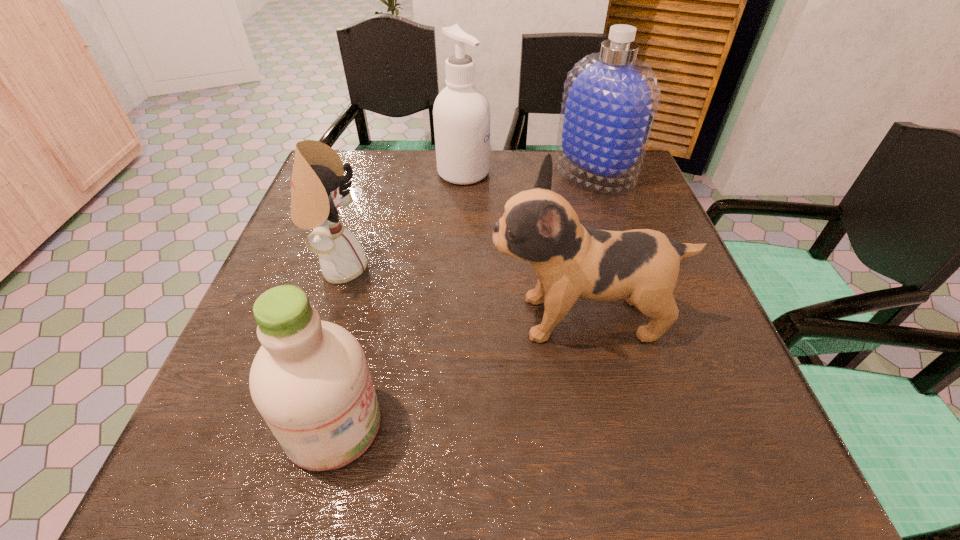
The image size is (960, 540). Find the location of `free space between the nearest object and the rightmost cleansing agent`. free space between the nearest object and the rightmost cleansing agent is located at coordinates (464, 299).

Find the location of a particular element. This screenshot has width=960, height=540. object that stands as the third closest to the puppy is located at coordinates (610, 99).

Identify which object is the closest to the second cleansing agent from left to right. Please provide its 2D coordinates. Your answer should be formatted as a tuple, i.e. [(x, y)], where the tuple contains the x and y coordinates of a point satisfying the conditions above.

[(610, 99)]

Where is `cleansing agent that is the closest to the rightmost cleansing agent`? This screenshot has width=960, height=540. cleansing agent that is the closest to the rightmost cleansing agent is located at coordinates (461, 113).

At what (x,y) coordinates should I click in order to perform the action: click on cleansing agent that can be found as the closest to the leftmost cleansing agent. Please return your answer as a coordinate pair (x, y). This screenshot has height=540, width=960. Looking at the image, I should click on (461, 113).

This screenshot has width=960, height=540. What are the coordinates of `vacant area in the image that satisfies the following two spatial constraints: 1. on the front label of the second cleansing agent from left to right; 2. on the back side of the rightmost cleansing agent` in the screenshot? It's located at (464, 174).

Image resolution: width=960 pixels, height=540 pixels. In order to click on free spot that satisfies the following two spatial constraints: 1. on the front side of the rightmost cleansing agent; 2. at the front face of the doll in this screenshot , I will do (626, 268).

Find the location of a particular element. free space that satisfies the following two spatial constraints: 1. on the front side of the rightmost cleansing agent; 2. at the front face of the doll is located at coordinates (626, 268).